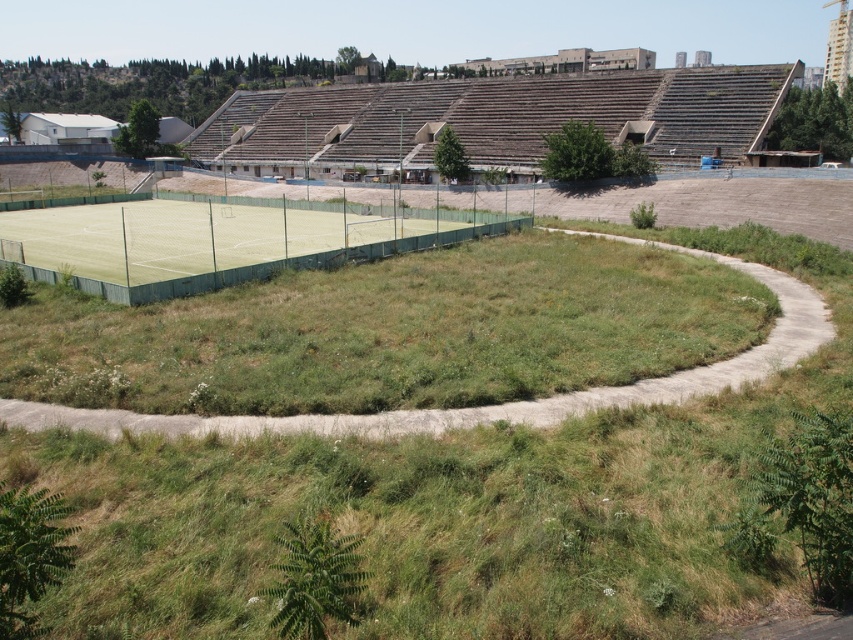
You are standing on the green synthetic turf tennis court at center and want to walk to the green grassy circle at center. Which direction should you move?

The green grassy circle at center is to the right of the green synthetic turf tennis court at center, so you should move to your right to reach it.

You are planning to host a small outdoor event and need to choose between the brown wooden amphitheater at upper center and the green synthetic turf tennis court at center. Which location can accommodate more people?

The brown wooden amphitheater at upper center is larger in size than the green synthetic turf tennis court at center, so it can accommodate more people.